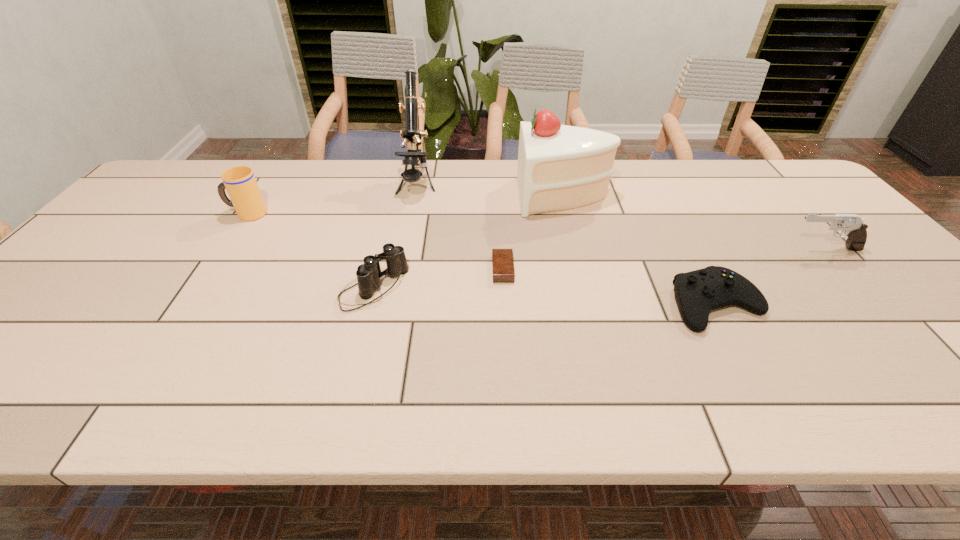
Find the location of a particular element. the fourth object from left to right is located at coordinates (502, 259).

Find the location of a particular element. This screenshot has height=540, width=960. alarm clock is located at coordinates (502, 259).

This screenshot has height=540, width=960. Identify the location of vacant area situated 0.070m through the eyepiece of the microscope. (411, 218).

Find the location of `vacant region located on the front of the cake`. vacant region located on the front of the cake is located at coordinates (576, 246).

This screenshot has width=960, height=540. Find the location of `vacant space located 0.160m on the side of the leftmost object with the handle`. vacant space located 0.160m on the side of the leftmost object with the handle is located at coordinates (173, 214).

Where is `blank space located on the side of the leftmost object with the handle`? Image resolution: width=960 pixels, height=540 pixels. blank space located on the side of the leftmost object with the handle is located at coordinates (201, 214).

Where is `vacant space located on the side of the leftmost object with the handle`? This screenshot has height=540, width=960. vacant space located on the side of the leftmost object with the handle is located at coordinates (187, 214).

Locate an element on the screen. The height and width of the screenshot is (540, 960). vacant space situated 0.130m at the muzzle of the fourth farthest object is located at coordinates (739, 248).

You are a GUI agent. You are given a task and a screenshot of the screen. Output one action in this format:
    pyautogui.click(x=<x>, y=<y>)
    Task: Click on the vacant space situated at the muzzle of the fourth farthest object
    This screenshot has width=960, height=540.
    Given the screenshot: What is the action you would take?
    pyautogui.click(x=762, y=248)

At what (x,y) coordinates should I click in order to perform the action: click on free space located 0.210m at the muzzle of the fourth farthest object. Please return your answer as a coordinate pair (x, y). Looking at the image, I should click on (709, 248).